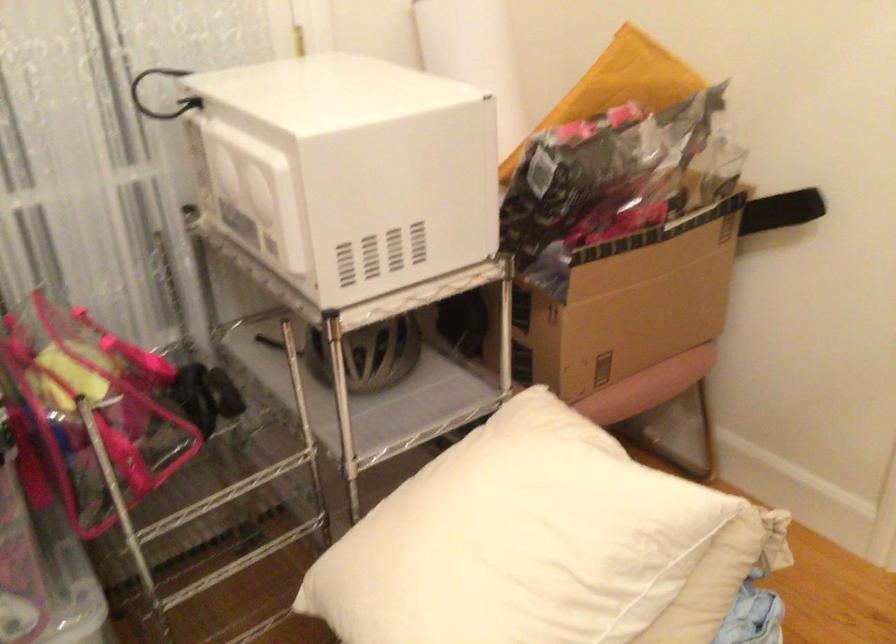
What do you see at coordinates (139, 359) in the screenshot?
I see `the pink bag handle` at bounding box center [139, 359].